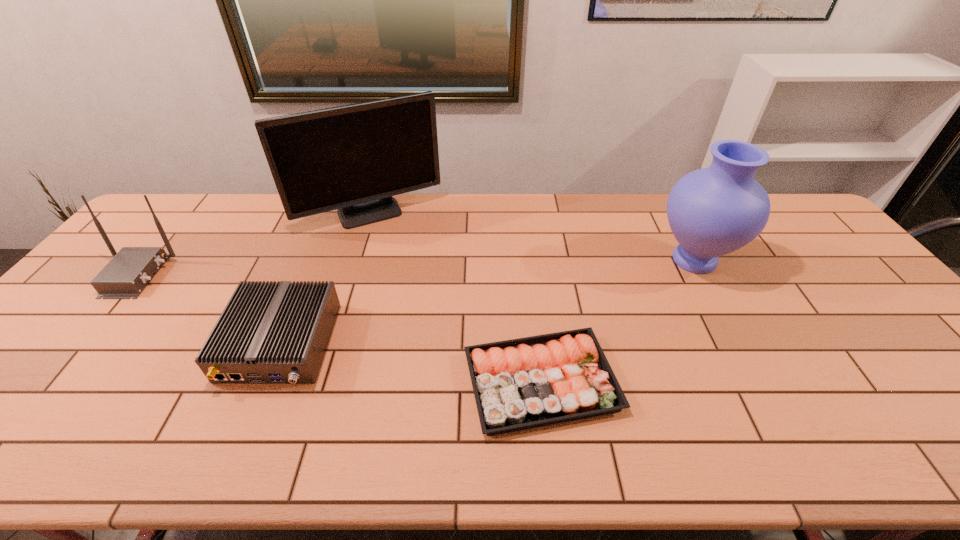
The height and width of the screenshot is (540, 960). What are the coordinates of `computer monitor` in the screenshot? It's located at (353, 158).

Where is `vase`? The image size is (960, 540). vase is located at coordinates (713, 211).

What are the coordinates of `the third tallest object` in the screenshot? It's located at (130, 270).

Identify the location of the taller router. (130, 270).

Locate an element on the screen. the right router is located at coordinates click(x=269, y=332).

Image resolution: width=960 pixels, height=540 pixels. Find the location of `the shorter router`. the shorter router is located at coordinates (269, 332).

This screenshot has width=960, height=540. What are the coordinates of `platter` in the screenshot? It's located at (518, 384).

The width and height of the screenshot is (960, 540). I want to click on the shortest object, so click(518, 384).

The height and width of the screenshot is (540, 960). I want to click on free space located on the front-facing side of the computer monitor, so click(x=361, y=248).

At what (x,y) coordinates should I click in order to perform the action: click on vacant space located 0.170m on the front of the rightmost object. Please return your answer as a coordinate pair (x, y). The height and width of the screenshot is (540, 960). Looking at the image, I should click on (735, 336).